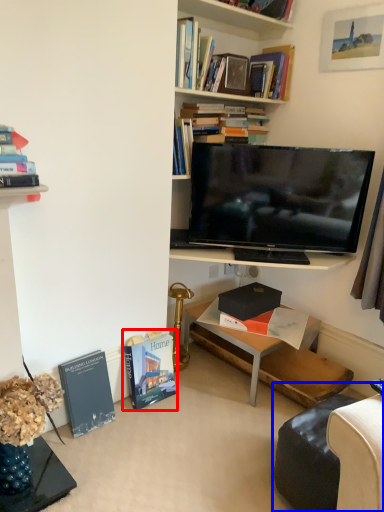
Question: Among these objects, which one is farthest to the camera, book (highlighted by a red box) or swivel chair (highlighted by a blue box)?

Choices:
 (A) book
 (B) swivel chair

Answer: (A)